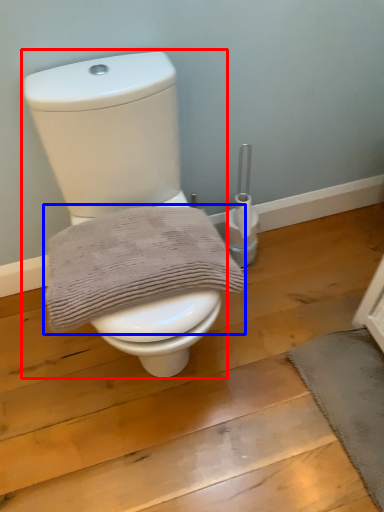
Question: Among these objects, which one is farthest to the camera, toilet (highlighted by a red box) or bath towel (highlighted by a blue box)?

Choices:
 (A) toilet
 (B) bath towel

Answer: (B)